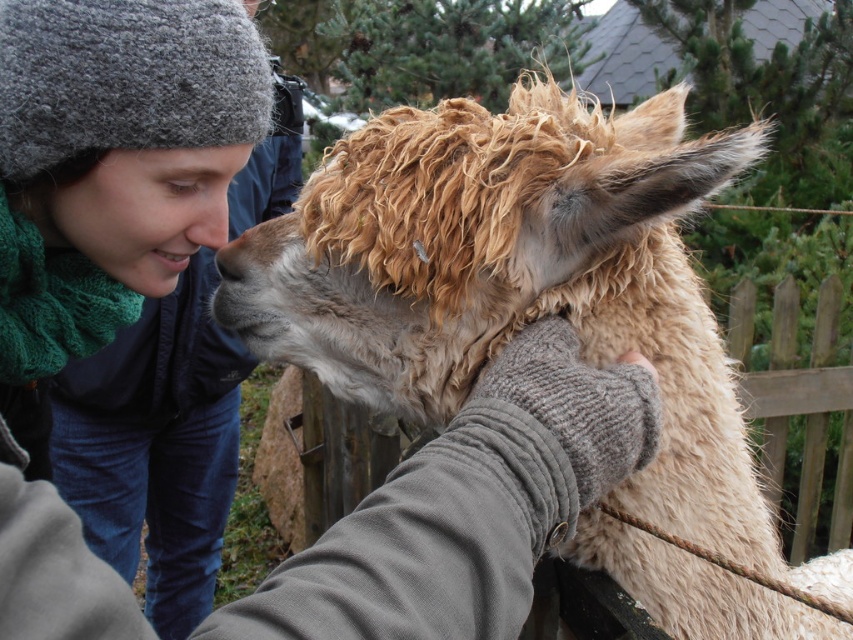
Who is taller, fuzzy beige alpaca at center or matte skin nose at center?

With more height is fuzzy beige alpaca at center.

This screenshot has width=853, height=640. Identify the location of fuzzy beige alpaca at center. (521, 282).

Is point (436, 317) positioned before point (207, 193)?

Yes, it is.

This screenshot has height=640, width=853. Find the location of `fuzzy beige alpaca at center`. fuzzy beige alpaca at center is located at coordinates (521, 282).

Who is more forward, [190,241] or [236,253]?

Positioned in front is point [190,241].

Which is in front, point (218, 216) or point (236, 253)?

Point (218, 216) is in front.

I want to click on matte skin nose at center, so click(206, 218).

Does fuzzy beige alpaca at center have a larger size compared to brown woolen nose at center?

Yes, fuzzy beige alpaca at center is bigger than brown woolen nose at center.

Is fuzzy beige alpaca at center further to camera compared to brown woolen nose at center?

No, it is not.

Does point (401, 285) lie in front of point (231, 278)?

Yes.

At what (x,y) coordinates should I click in order to perform the action: click on fuzzy beige alpaca at center. Please return your answer as a coordinate pair (x, y). The width and height of the screenshot is (853, 640). Looking at the image, I should click on 521,282.